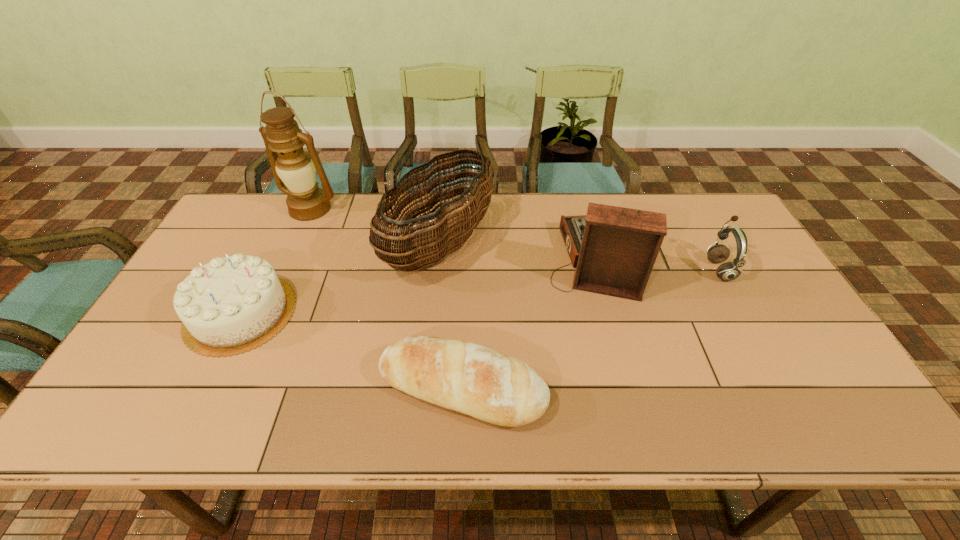
Locate an element on the screen. The height and width of the screenshot is (540, 960). the tallest object is located at coordinates (295, 168).

At what (x,y) coordinates should I click in order to perform the action: click on phonograph record. Please return your answer as a coordinate pair (x, y). Looking at the image, I should click on (614, 248).

Where is `basket`? The width and height of the screenshot is (960, 540). basket is located at coordinates 437,238.

I want to click on the rightmost object, so click(728, 271).

Where is `birthday cake`? The width and height of the screenshot is (960, 540). birthday cake is located at coordinates (231, 305).

Identify the location of the shortest object. (458, 375).

Find the location of a particular element. This screenshot has width=960, height=540. free point located on the right of the oil lamp is located at coordinates (370, 208).

At what (x,y) coordinates should I click in order to perform the action: click on vacant area located 0.110m on the left of the second object from right to left. Please return your answer as a coordinate pair (x, y). This screenshot has width=960, height=540. Looking at the image, I should click on click(x=511, y=260).

What are the coordinates of `vacant space located on the front of the basket` in the screenshot? It's located at 434,314.

This screenshot has width=960, height=540. I want to click on free space located 0.090m on the ear pads of the earphone, so click(677, 269).